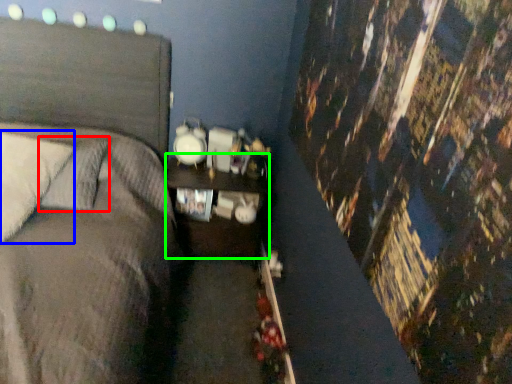
Question: Estimate the real-world distances between objects in this image. Which object is closer to pillow (highlighted by a red box), pillow (highlighted by a blue box) or nightstand (highlighted by a green box)?

Choices:
 (A) pillow
 (B) nightstand

Answer: (A)